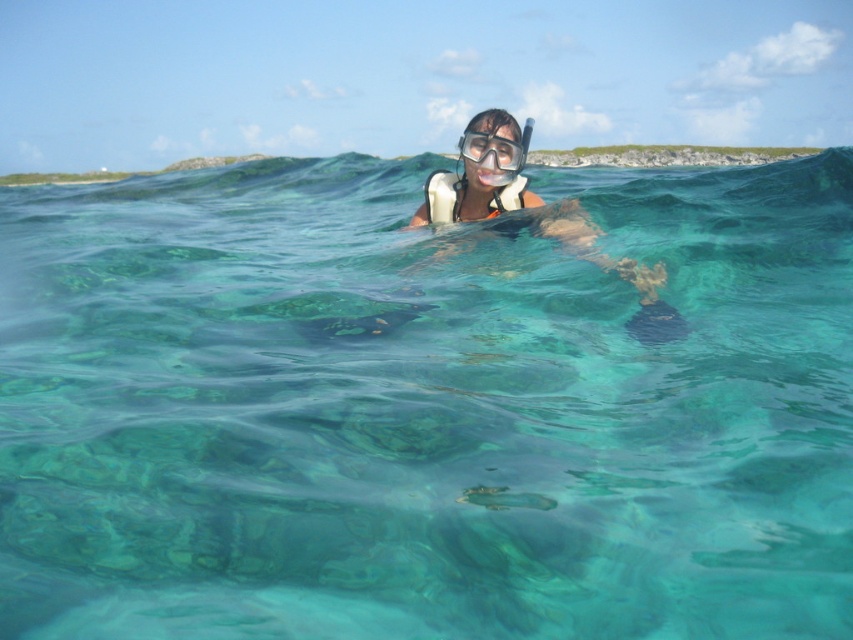
Question: Among these objects, which one is farthest from the camera?

Choices:
 (A) clear plastic goggles at center
 (B) clear plastic snorkel at center

Answer: (B)

Question: Which of the following is the closest to the observer?

Choices:
 (A) (482, 154)
 (B) (433, 202)

Answer: (A)

Question: Is clear plastic snorkel at center to the left of clear plastic goggles at center from the viewer's perspective?

Choices:
 (A) no
 (B) yes

Answer: (A)

Question: Among these points, which one is farthest from the camera?

Choices:
 (A) (520, 202)
 (B) (473, 147)

Answer: (A)

Question: Can you confirm if clear plastic snorkel at center is positioned above clear plastic goggles at center?

Choices:
 (A) yes
 (B) no

Answer: (A)

Question: Does clear plastic snorkel at center appear over clear plastic goggles at center?

Choices:
 (A) yes
 (B) no

Answer: (A)